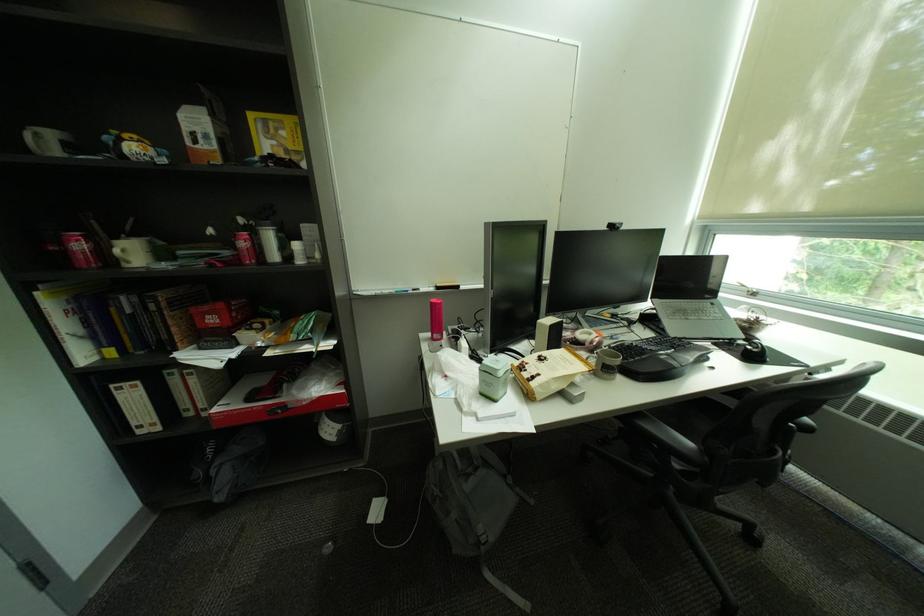
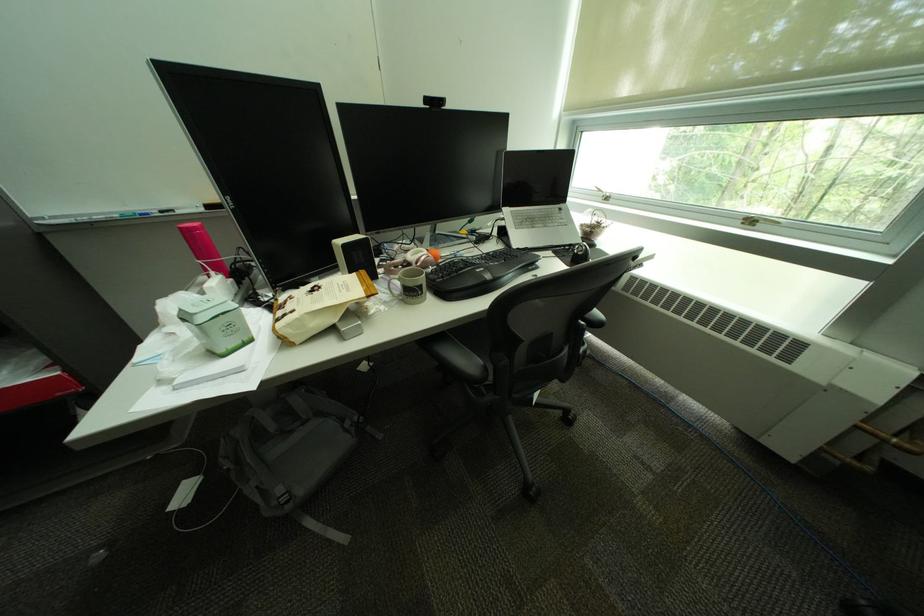
In the second image, find the point that corresponds to point (743, 341) in the first image.

(580, 246)